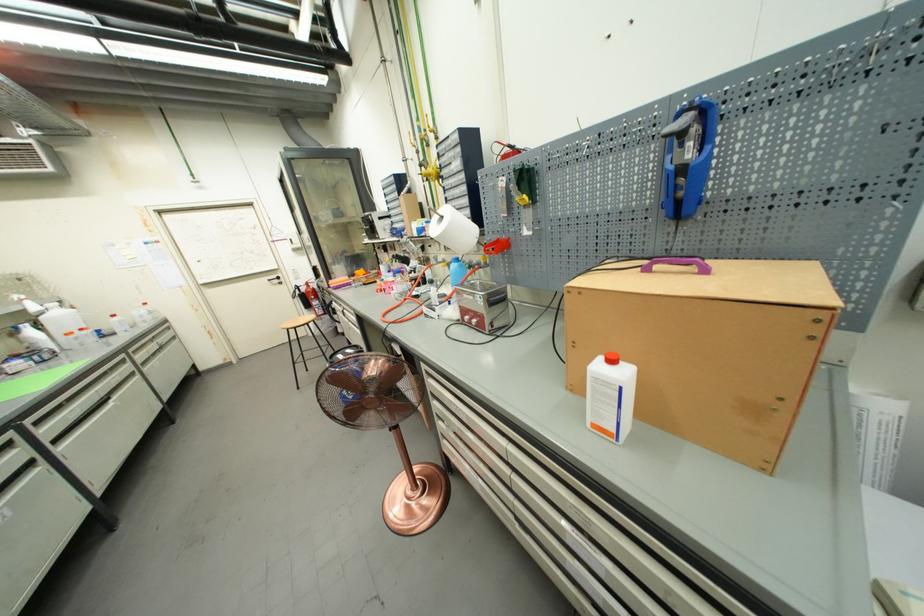
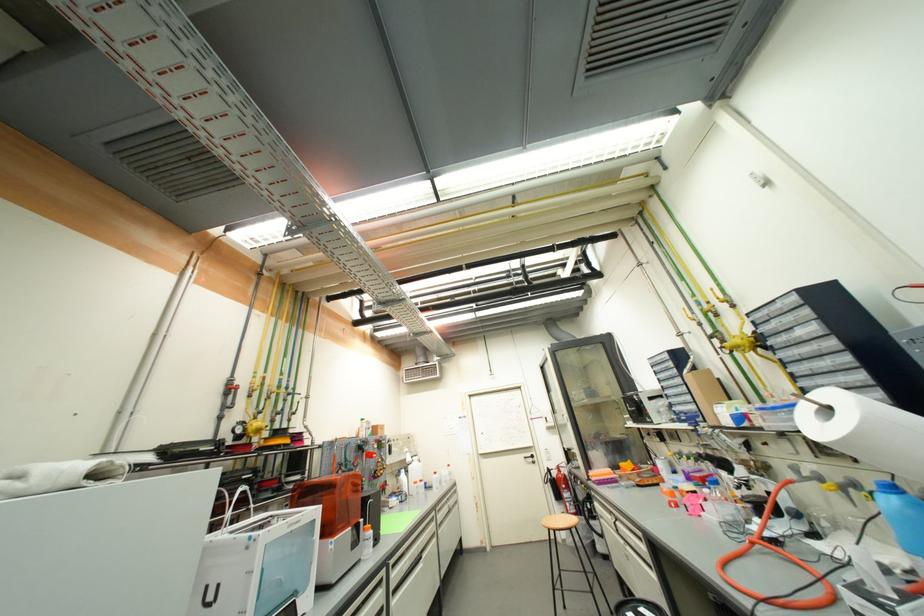
Where in the second image is the point corresponding to the point at 323,306 from the first image?

(575, 500)